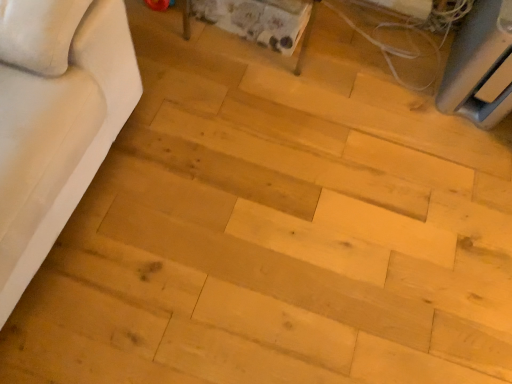
This screenshot has height=384, width=512. In order to click on vacant space in front of matte gray table at upper right in this screenshot , I will do `click(451, 147)`.